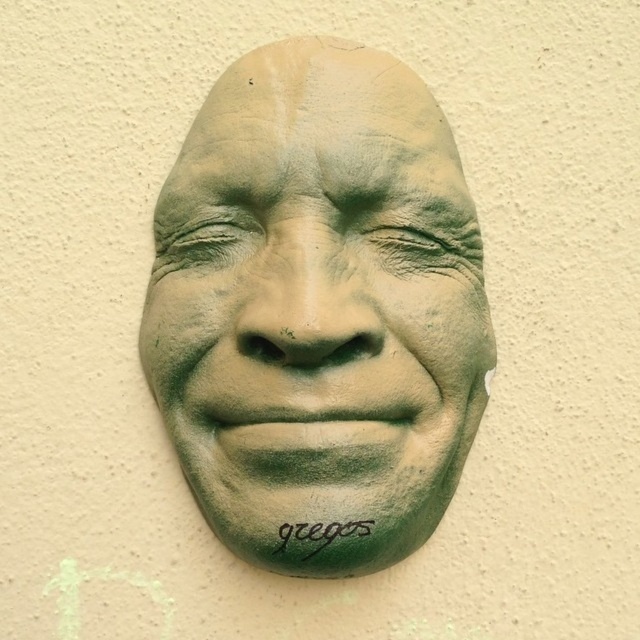
Does green clay mask at center come behind green matte text at center?

No, it is in front of green matte text at center.

Who is positioned more to the left, green clay mask at center or green matte text at center?

green clay mask at center

Measure the distance between point (336, 188) and camera.

Point (336, 188) is 4.37 feet from camera.

Where is `green clay mask at center`? The image size is (640, 640). green clay mask at center is located at coordinates (317, 305).